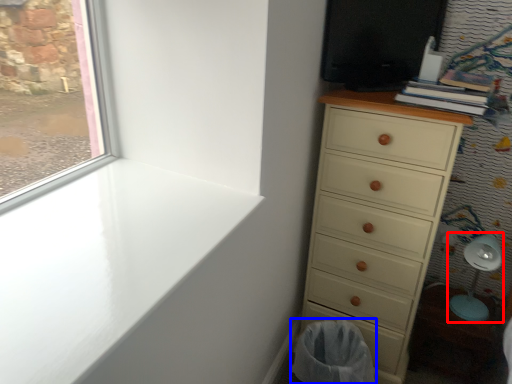
Question: Which object appears closest to the camera in this image, swivel chair (highlighted by a red box) or laundry basket (highlighted by a blue box)?

Choices:
 (A) swivel chair
 (B) laundry basket

Answer: (B)